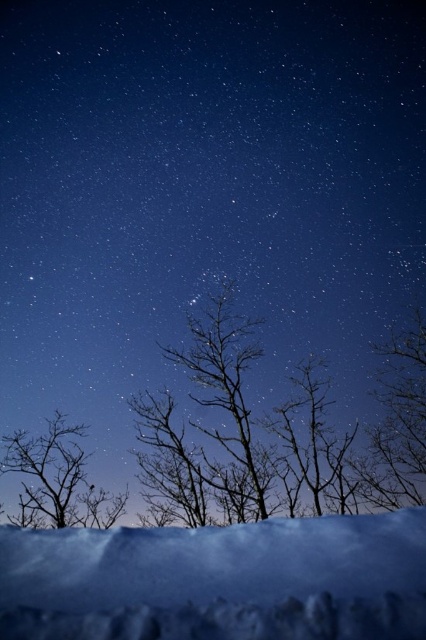
What do you see at coordinates (218, 580) in the screenshot?
I see `white fluffy snow at lower center` at bounding box center [218, 580].

Consider the image. Can you confirm if white fluffy snow at lower center is positioned below silhouette bare tree at left?

Actually, white fluffy snow at lower center is above silhouette bare tree at left.

Between point (23, 595) and point (16, 435), which one is positioned in front?

Point (23, 595) is more forward.

The width and height of the screenshot is (426, 640). In order to click on white fluffy snow at lower center in this screenshot , I will do `click(218, 580)`.

Is silhouette bare tree at center thinner than silhouette bare tree at left?

Correct, silhouette bare tree at center's width is less than silhouette bare tree at left's.

Between point (210, 362) and point (60, 452), which one is positioned in front?

Positioned in front is point (210, 362).

Describe the element at coordinates (276, 435) in the screenshot. The height and width of the screenshot is (640, 426). I see `silhouette bare tree at center` at that location.

Locate an element on the screen. silhouette bare tree at center is located at coordinates (276, 435).

Between point (213, 461) and point (212, 611), which one is positioned in front?

Point (212, 611) is more forward.

Is point (25, 468) more distant than point (71, 536)?

Yes, point (25, 468) is farther from viewer.

Identify the location of silhouette bare tree at center. (276, 435).